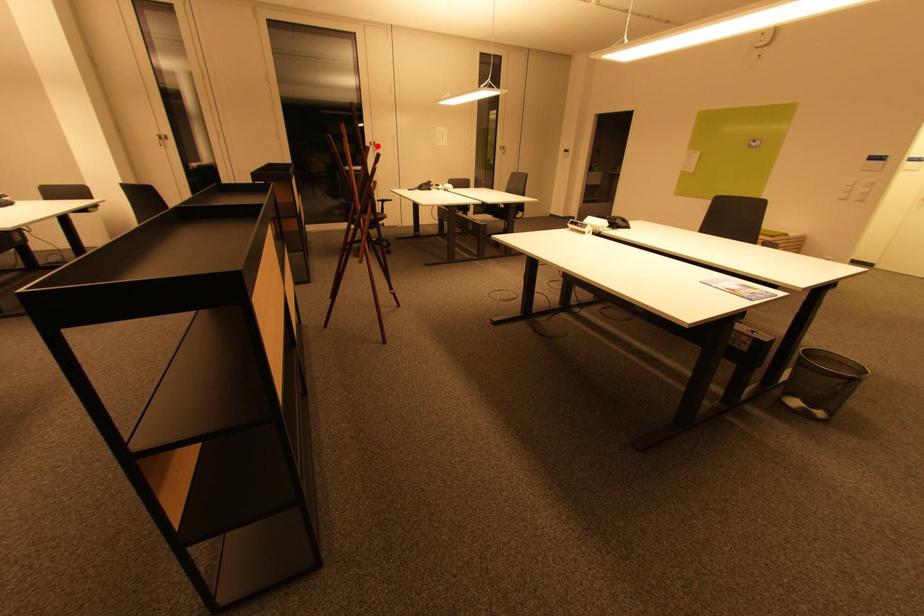
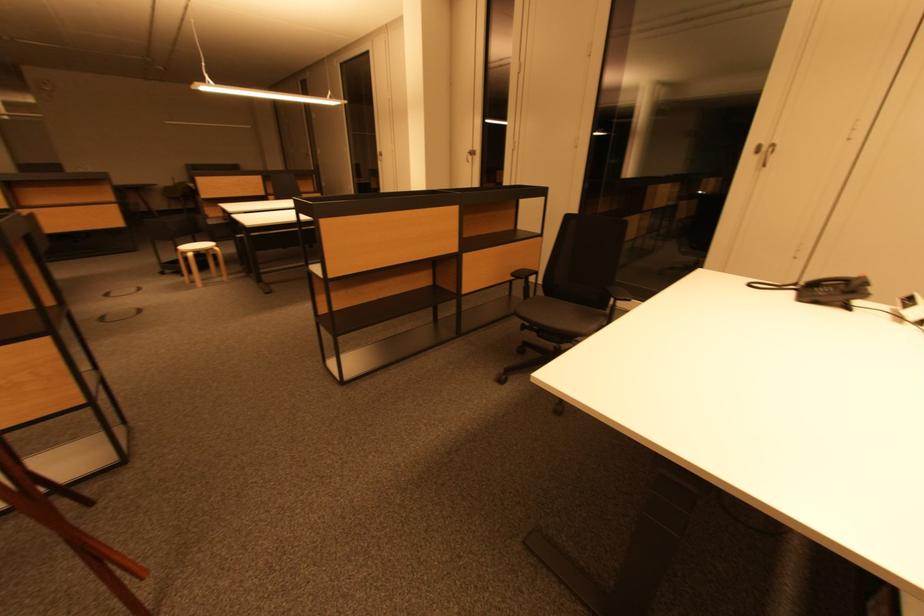
Where in the second image is the point corresponding to the highlighted location from the first image?

(767, 150)